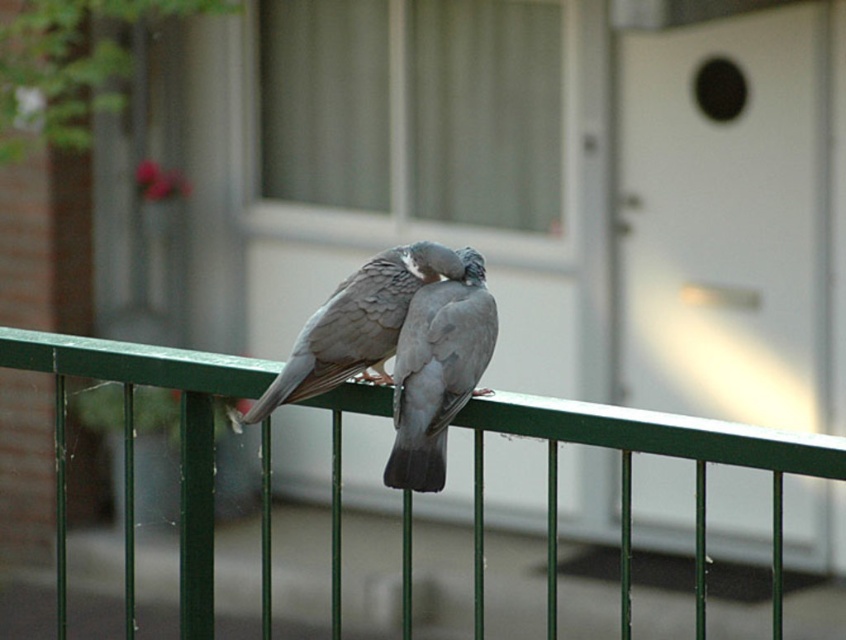
You are a birdwatcher standing in front of the green metal fence at center where the gray matte pigeon at center is perched. Can you see the pigeon clearly from your current position?

The green metal fence at center is positioned under the gray matte pigeon at center, so the pigeon is above the fence and can be seen clearly from your position.

Looking at this image, you are a birdwatcher observing two birds on a green metal railing. You see the gray matte pigeon at center and the gray matte dove at center. Which bird is taller?

The gray matte pigeon at center is much taller than the gray matte dove at center.

You are standing in front of a green metal fence at center where two pigeons are perched. You want to toss a small crumb to the pigeons without getting too close. If your arm can reach 2 meters, will you be able to reach the pigeons?

The green metal fence at center and viewer are 2.64 meters apart from each other. Since your arm can reach 2 meters, you are 0.64 meters too far to reach the pigeons.